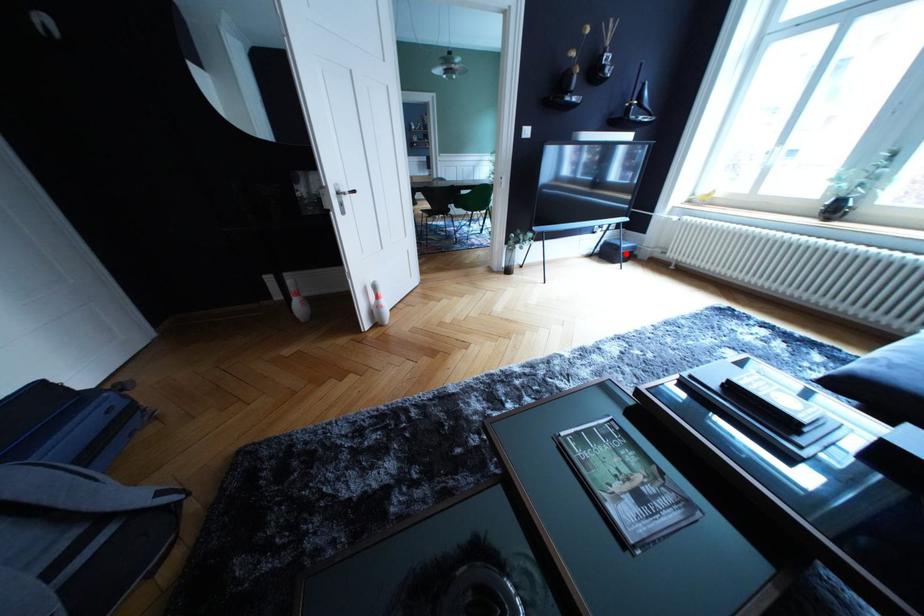
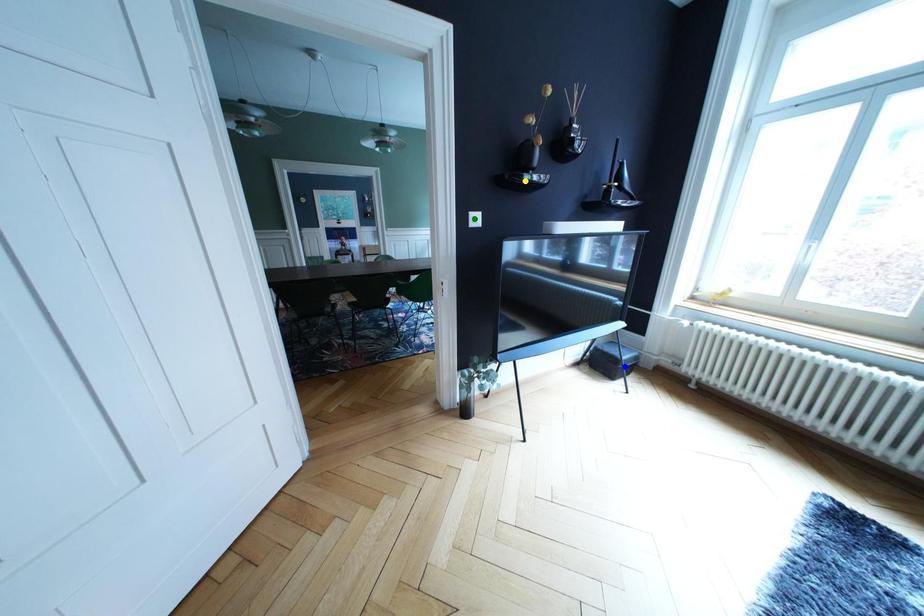
Question: I am providing you with two images of the same scene from different viewpoints. A red point is marked on the first image. You are given multiple points on the second image. Can you choose the point in image 2 that corresponds to the point in image 1?

Choices:
 (A) yellow point
 (B) blue point
 (C) green point

Answer: (B)